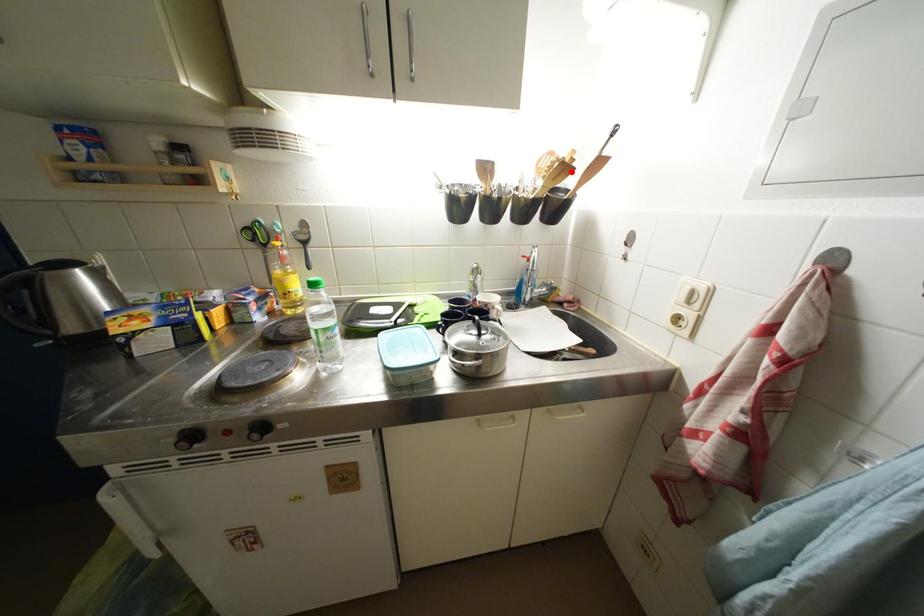
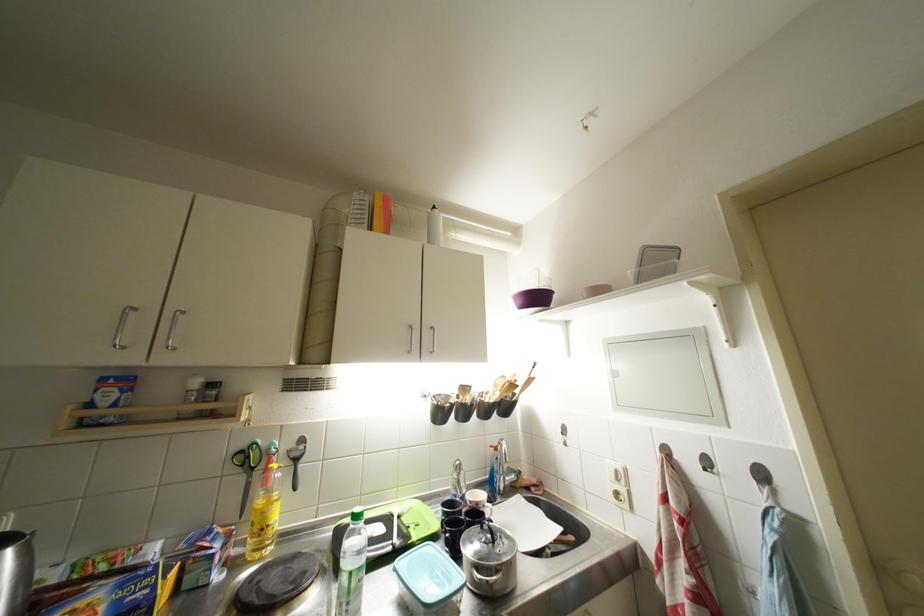
The point at the highlighted location is marked in the first image. Where is the corresponding point in the second image?

(519, 390)